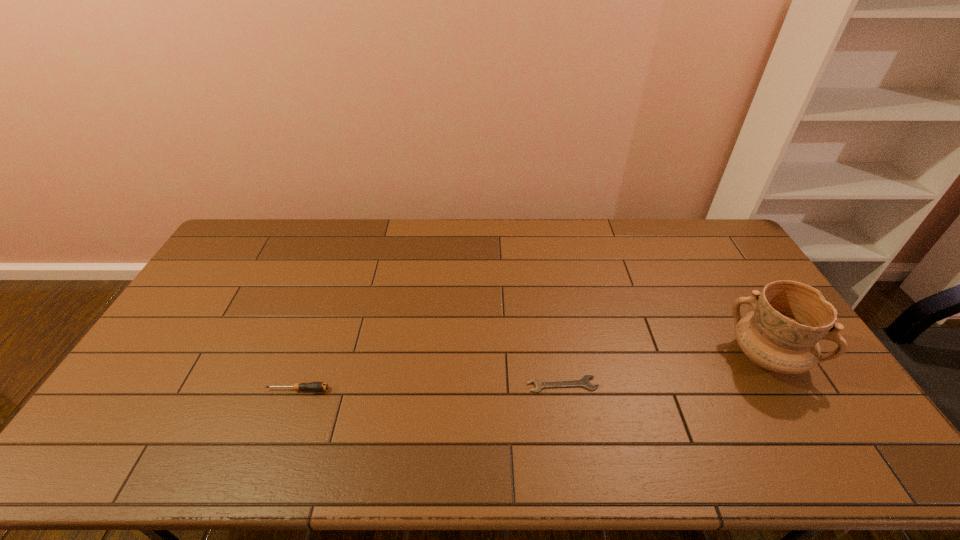
Identify the location of free space between the pottery and the screwdriver. The width and height of the screenshot is (960, 540). (532, 373).

Locate an element on the screen. Image resolution: width=960 pixels, height=540 pixels. empty space between the leftmost object and the second object from right to left is located at coordinates (430, 387).

This screenshot has width=960, height=540. What are the coordinates of `free area in between the rightmost object and the second shortest object` in the screenshot? It's located at (532, 373).

Identify the location of free space between the wrench and the rightmost object. Image resolution: width=960 pixels, height=540 pixels. (664, 370).

Select which object appears as the second closest to the leftmost object. Please provide its 2D coordinates. Your answer should be formatted as a tuple, i.e. [(x, y)], where the tuple contains the x and y coordinates of a point satisfying the conditions above.

[(782, 333)]

The width and height of the screenshot is (960, 540). Find the location of `the second closest object relative to the wrench`. the second closest object relative to the wrench is located at coordinates (313, 386).

This screenshot has height=540, width=960. In order to click on vacant point that satisfies the following two spatial constraints: 1. on the back side of the screwdriver; 2. on the right side of the rightmost object in this screenshot , I will do `click(310, 356)`.

Where is `blank area in the image that satisfies the following two spatial constraints: 1. on the back side of the pottery; 2. on the right side of the screwdriver`? The image size is (960, 540). blank area in the image that satisfies the following two spatial constraints: 1. on the back side of the pottery; 2. on the right side of the screwdriver is located at coordinates (310, 356).

The height and width of the screenshot is (540, 960). I want to click on vacant point that satisfies the following two spatial constraints: 1. on the back side of the pottery; 2. on the right side of the shortest object, so click(x=558, y=356).

Identify the location of blank space that satisfies the following two spatial constraints: 1. on the back side of the screwdriver; 2. on the left side of the pottery. Image resolution: width=960 pixels, height=540 pixels. [310, 356].